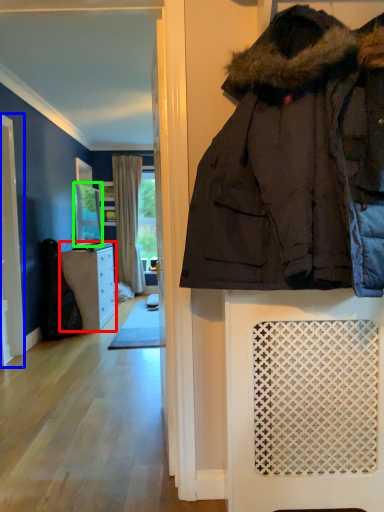
Question: Which object is positioned closest to cabinetry (highlighted by a red box)? Select from screen door (highlighted by a blue box) and mirror (highlighted by a green box).

Choices:
 (A) screen door
 (B) mirror

Answer: (B)